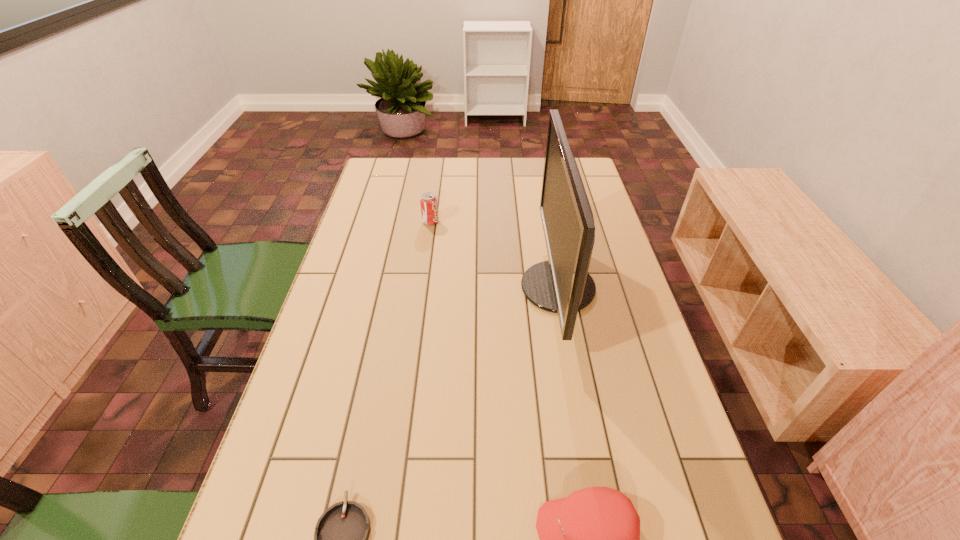
Identify the location of the third nearest object. The width and height of the screenshot is (960, 540). (562, 285).

At what (x,y) coordinates should I click in order to perform the action: click on the tallest object. Please return your answer as a coordinate pair (x, y). This screenshot has width=960, height=540. Looking at the image, I should click on (562, 285).

The height and width of the screenshot is (540, 960). I want to click on soda can, so click(429, 210).

Locate an element on the screen. The width and height of the screenshot is (960, 540). the second object from left to right is located at coordinates [x=429, y=210].

This screenshot has width=960, height=540. Find the location of `vacant space located on the screen side of the third nearest object`. vacant space located on the screen side of the third nearest object is located at coordinates (487, 287).

The height and width of the screenshot is (540, 960). What are the coordinates of `blank space located on the screen side of the third nearest object` in the screenshot? It's located at (472, 287).

The image size is (960, 540). In order to click on free space located 0.310m on the screen side of the third nearest object in this screenshot , I will do `click(414, 287)`.

Image resolution: width=960 pixels, height=540 pixels. Find the location of `vacant space located 0.230m on the front of the third shortest object`. vacant space located 0.230m on the front of the third shortest object is located at coordinates (423, 272).

Where is `object positioned at the right edge`? The image size is (960, 540). object positioned at the right edge is located at coordinates (562, 285).

Locate an element on the screen. vacant space at the far edge is located at coordinates (529, 183).